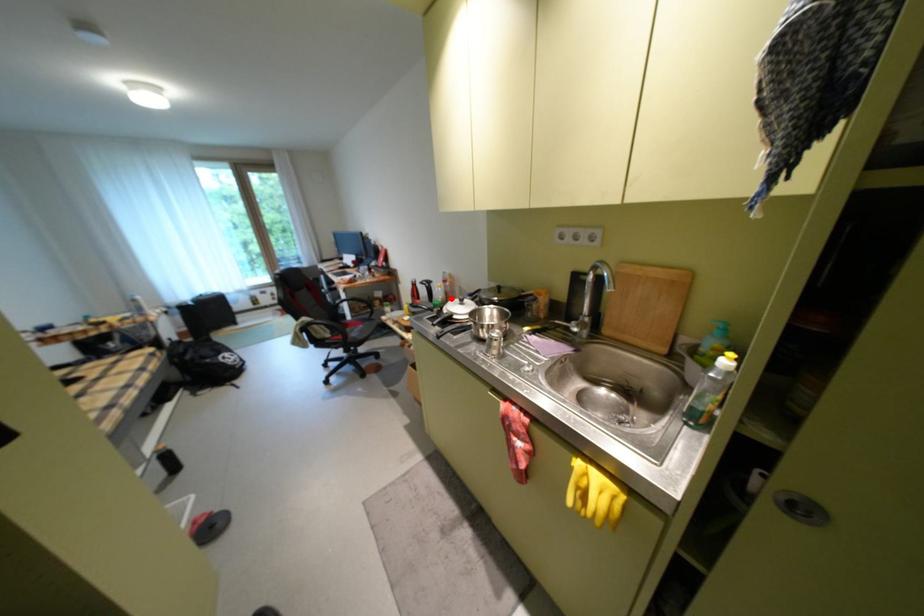
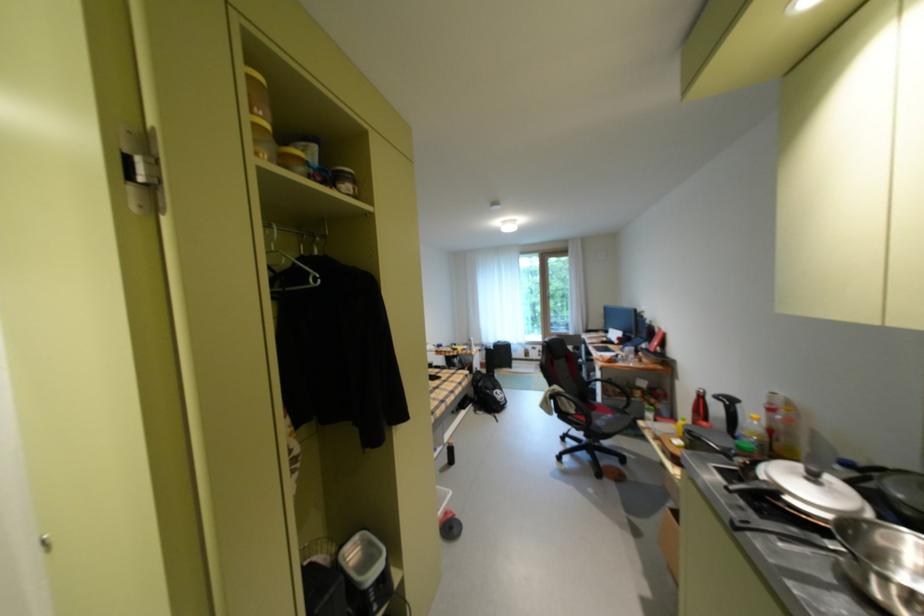
Question: I am providing you with two images of the same scene from different viewpoints. Image1 has a red point marked. In image2, the corresponding 3D location appears at what relative position? Reply with the corresponding letter.

Choices:
 (A) Closer
 (B) Farther

Answer: (A)